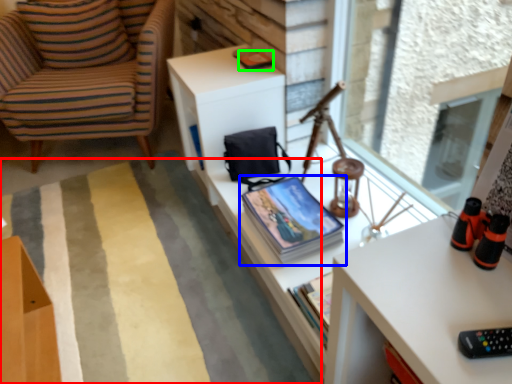
Question: Which object is positioned closest to plain (highlighted by a red box)? Select from book (highlighted by a blue box) and magazine (highlighted by a green box).

Choices:
 (A) book
 (B) magazine

Answer: (A)